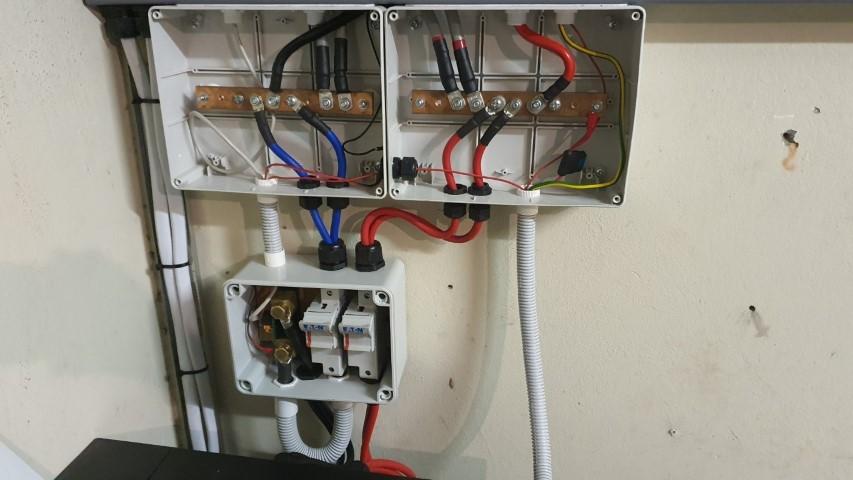
You are a GUI agent. You are given a task and a screenshot of the screen. Output one action in this format:
    pyautogui.click(x=<x>, y=<y>)
    Task: Click on the junction box
    Image resolution: width=853 pixels, height=480 pixels.
    Given the screenshot: What is the action you would take?
    pyautogui.click(x=500, y=147), pyautogui.click(x=228, y=125)